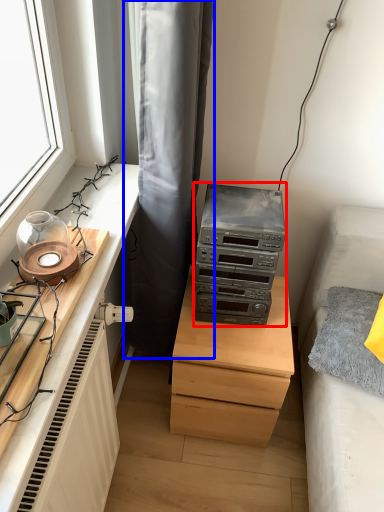
Question: Which point is closer to the camera, stereo (highlighted by a red box) or curtain (highlighted by a blue box)?

Choices:
 (A) stereo
 (B) curtain

Answer: (B)